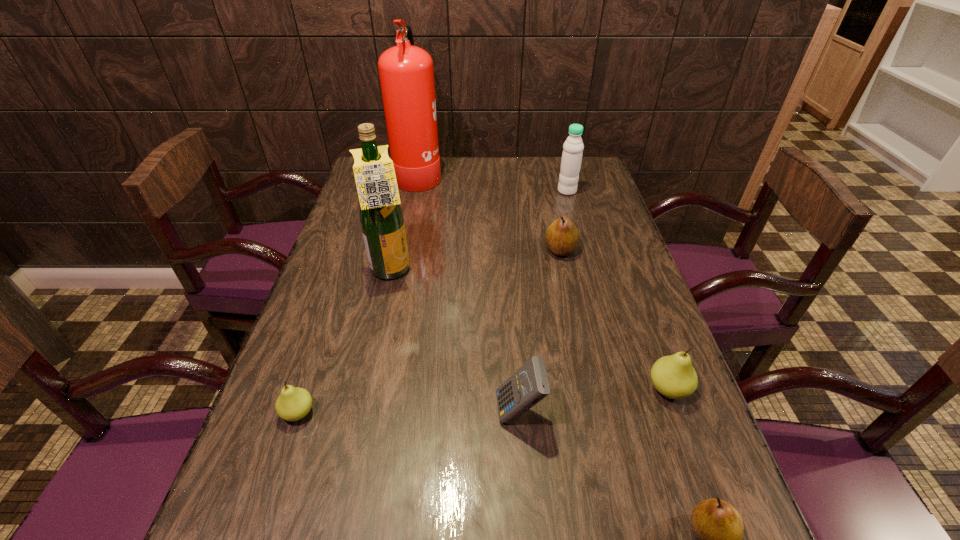
This screenshot has width=960, height=540. What are the coordinates of `pear that is the second closest to the red fire extinguisher` in the screenshot? It's located at (293, 403).

At what (x,y) coordinates should I click in order to perform the action: click on vacant space that satisfies the following two spatial constraints: 1. on the front side of the right green pear; 2. on the front-facing side of the fifth object from right to left. Please return your answer as a coordinate pair (x, y). Looking at the image, I should click on (677, 413).

Image resolution: width=960 pixels, height=540 pixels. I want to click on free spot that satisfies the following two spatial constraints: 1. on the back side of the leftmost pear; 2. on the left side of the bigger brown pear, so click(353, 250).